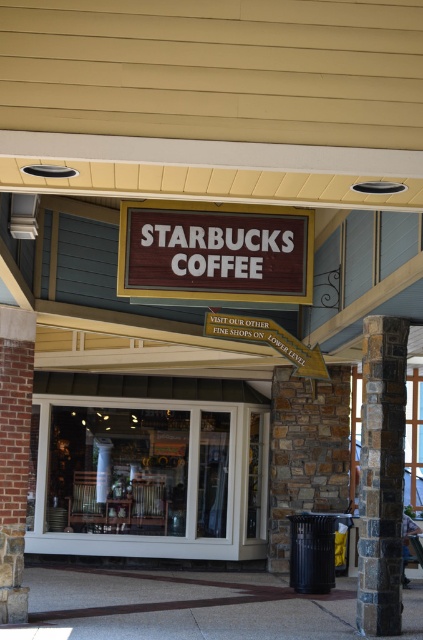
You are standing outside the Starbucks Coffee shop and want to enter. Which object should you approach first to go inside? The white glass door at center or the wooden sign at center?

The white glass door at center is located below the wooden sign at center, so you should approach the white glass door at center first to enter the shop.

You are standing outside the Starbucks Coffee shop and want to enter through the entrance. Which object should you approach first, the white glass door at center or the wooden sign at center?

The white glass door at center is to the left of the wooden sign at center, so you should approach the white glass door at center first to enter the Starbucks Coffee shop.